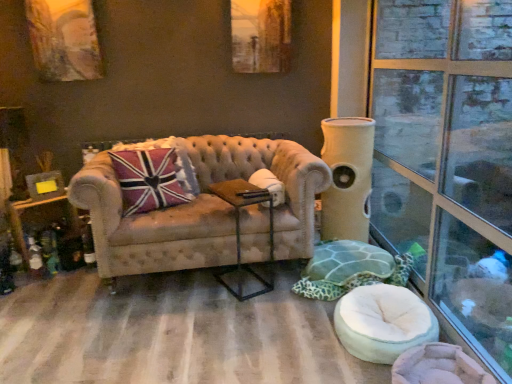
Where is `blank area to the left of green fabric swivel chair at lower right, placed as the 2th swivel chair when sorted from front to back`? This screenshot has width=512, height=384. blank area to the left of green fabric swivel chair at lower right, placed as the 2th swivel chair when sorted from front to back is located at coordinates (240, 296).